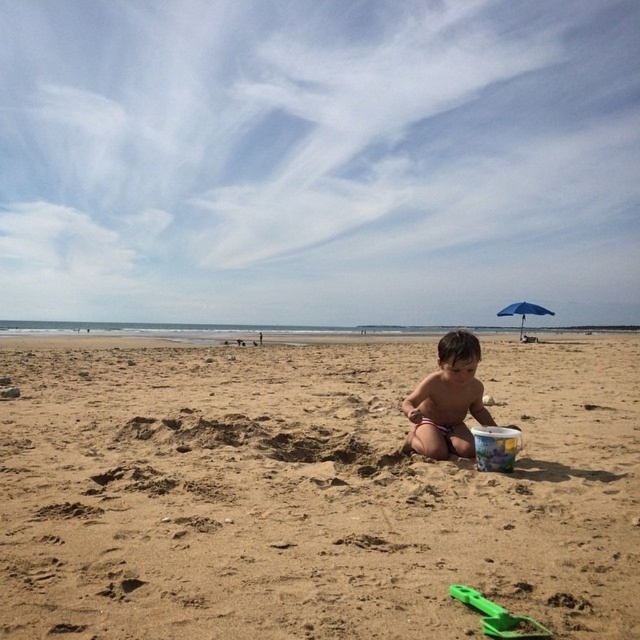
Who is lower down, brown sandy beach at center or green plastic shovel at lower center?

Positioned lower is green plastic shovel at lower center.

Between brown sandy beach at center and green plastic shovel at lower center, which one is positioned higher?

brown sandy beach at center is higher up.

Is point (74, 449) more distant than point (531, 625)?

Yes, point (74, 449) is behind point (531, 625).

Where is `brown sandy beach at center`? This screenshot has width=640, height=640. brown sandy beach at center is located at coordinates (308, 493).

Based on the photo, does smooth skin child at center appear on the right side of blue fabric umbrella at upper right?

No, smooth skin child at center is not to the right of blue fabric umbrella at upper right.

Is point (440, 369) in front of point (532, 314)?

Yes, point (440, 369) is in front of point (532, 314).

Where is `smooth skin child at center`? The width and height of the screenshot is (640, 640). smooth skin child at center is located at coordinates (448, 401).

In the scene shown: Is smooth skin child at center further to the viewer compared to smooth plastic bucket at lower right?

Yes, smooth skin child at center is further from the viewer.

Who is more distant from viewer, (440, 380) or (515, 435)?

The point (440, 380) is more distant.

Locate an element on the screen. smooth skin child at center is located at coordinates (448, 401).